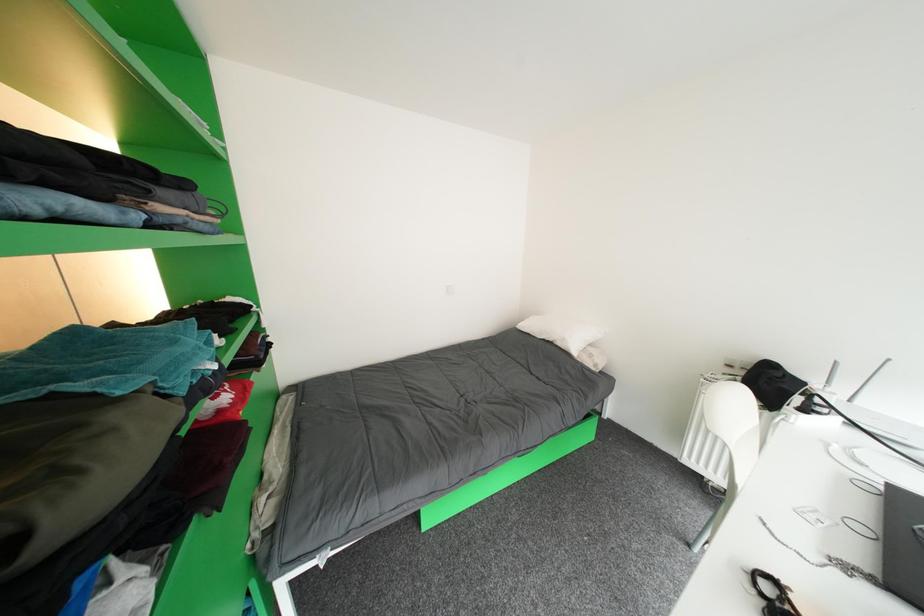
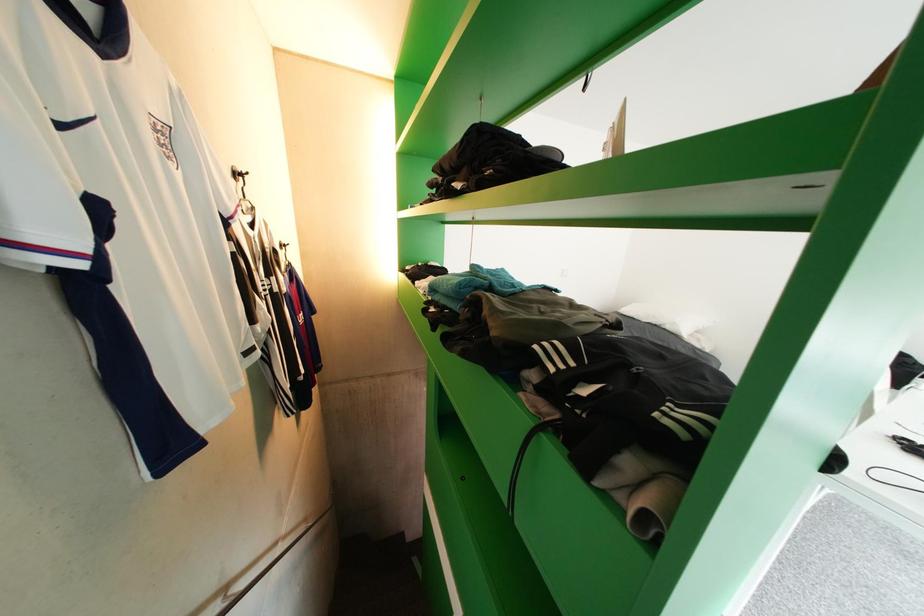
What movement of the cameraman would produce the second image?

The cameraman walked toward left, backward.